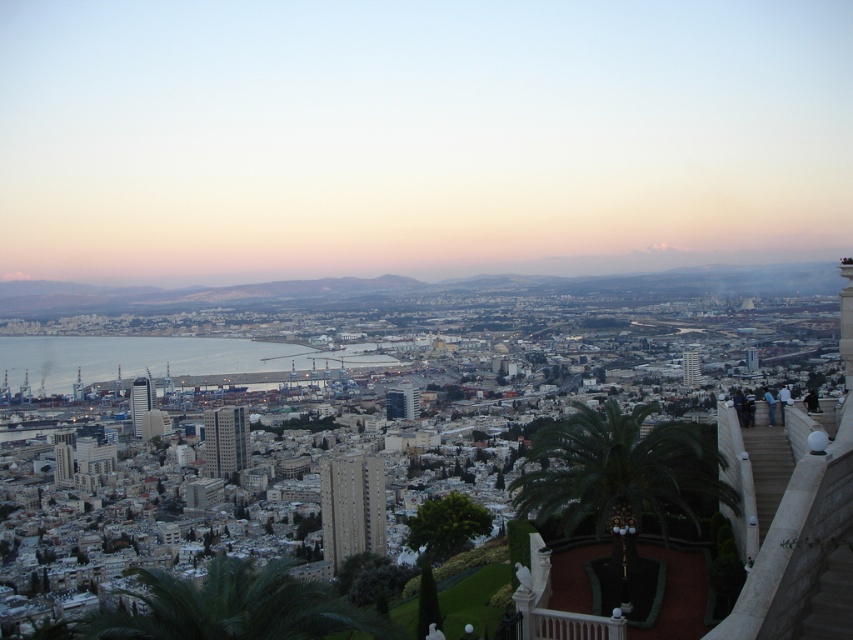
Question: Can you confirm if green leafy palm tree at lower center is smaller than blue water at center?

Choices:
 (A) yes
 (B) no

Answer: (A)

Question: Does green leafy palm at center have a greater width compared to blue water at center?

Choices:
 (A) no
 (B) yes

Answer: (A)

Question: Which of the following is the farthest from the observer?

Choices:
 (A) green leafy palm tree at lower center
 (B) blue water at center

Answer: (B)

Question: Is the position of green leafy palm at center less distant than that of green leafy palm tree at lower center?

Choices:
 (A) yes
 (B) no

Answer: (B)

Question: Which point is closer to the camera?

Choices:
 (A) blue water at center
 (B) green leafy palm tree at lower center

Answer: (B)

Question: Which of the following is the farthest from the observer?

Choices:
 (A) green leafy palm tree at lower center
 (B) green leafy palm at center
 (C) blue water at center

Answer: (B)